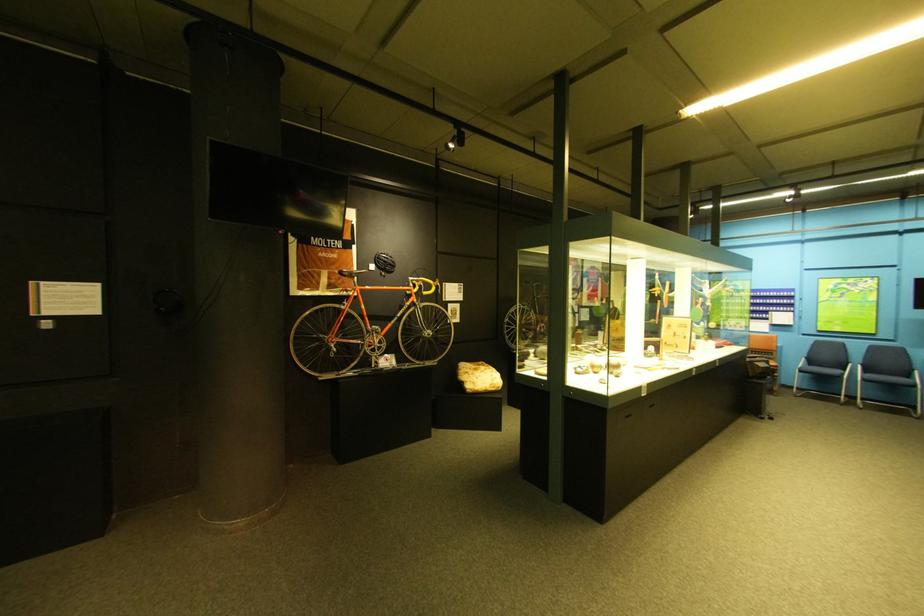
What do you see at coordinates (627, 415) in the screenshot? This screenshot has height=616, width=924. I see `the cabinet inset handle` at bounding box center [627, 415].